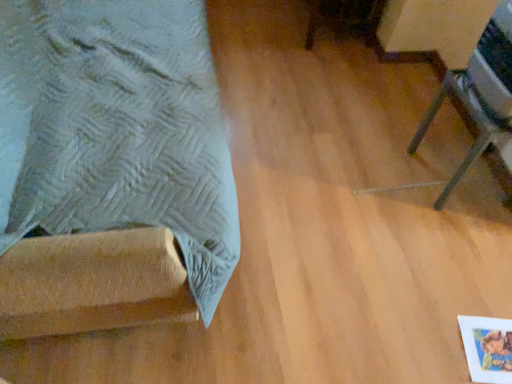
Question: Is point (200, 167) positioned closer to the camera than point (461, 84)?

Choices:
 (A) closer
 (B) farther

Answer: (A)

Question: From the image's perspective, relative to metallic silver tripod at right, the second furniture positioned from the left, is suede-like fabric at left, positioned as the second furniture in right-to-left order, above or below?

Choices:
 (A) above
 (B) below

Answer: (A)

Question: Is suede-like fabric at left, which ranks as the first furniture in left-to-right order, to the left or to the right of metallic silver tripod at right, the second furniture positioned from the left, in the image?

Choices:
 (A) right
 (B) left

Answer: (B)

Question: From the image's perspective, is metallic silver tripod at right, the first furniture from the right, above or below suede-like fabric at left, positioned as the second furniture in right-to-left order?

Choices:
 (A) below
 (B) above

Answer: (A)

Question: Is metallic silver tripod at right, the second furniture positioned from the left, in front of or behind suede-like fabric at left, positioned as the second furniture in right-to-left order, in the image?

Choices:
 (A) front
 (B) behind

Answer: (B)

Question: From a real-world perspective, is metallic silver tripod at right, the second furniture positioned from the left, above or below suede-like fabric at left, which ranks as the first furniture in left-to-right order?

Choices:
 (A) above
 (B) below

Answer: (B)

Question: Does point click(508, 9) appear closer or farther from the camera than point click(158, 273)?

Choices:
 (A) farther
 (B) closer

Answer: (A)